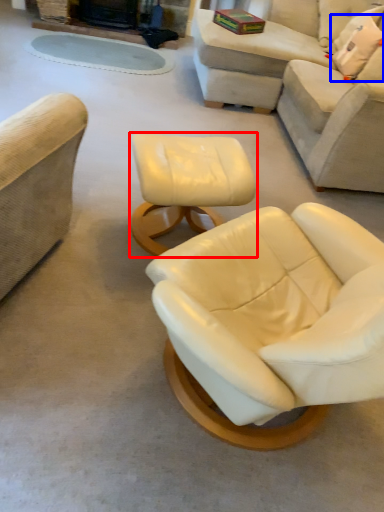
Question: Which of the following is the farthest to the observer, table (highlighted by a red box) or pillow (highlighted by a blue box)?

Choices:
 (A) table
 (B) pillow

Answer: (B)